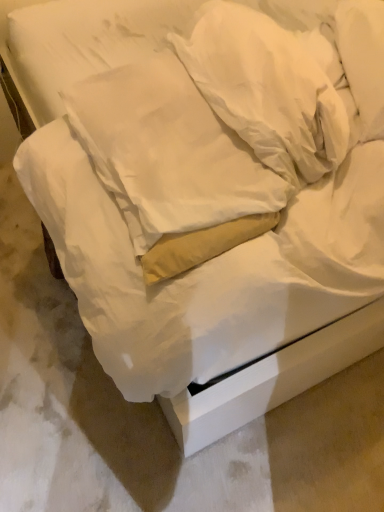
The height and width of the screenshot is (512, 384). What do you see at coordinates (169, 152) in the screenshot?
I see `white soft pillow at center, the second pillow in the right-to-left sequence` at bounding box center [169, 152].

I want to click on white soft pillow at center, the second pillow in the right-to-left sequence, so click(169, 152).

Describe the element at coordinates (270, 87) in the screenshot. I see `white soft pillow at upper center, the first pillow viewed from the right` at that location.

The height and width of the screenshot is (512, 384). I want to click on white soft pillow at upper center, which is the second pillow in left-to-right order, so click(270, 87).

At what (x,y) coordinates should I click in order to perform the action: click on white soft pillow at center, which appears as the 1th pillow when viewed from the left. Please return your answer as a coordinate pair (x, y). Looking at the image, I should click on (169, 152).

Is white soft pillow at center, the second pillow in the right-to-left sequence, at the left side of white soft pillow at upper center, which is the second pillow in left-to-right order?

Indeed, white soft pillow at center, the second pillow in the right-to-left sequence, is positioned on the left side of white soft pillow at upper center, which is the second pillow in left-to-right order.

Considering their positions, is white soft pillow at center, which appears as the 1th pillow when viewed from the left, located in front of or behind white soft pillow at upper center, which is the second pillow in left-to-right order?

Clearly, white soft pillow at center, which appears as the 1th pillow when viewed from the left, is in front of white soft pillow at upper center, which is the second pillow in left-to-right order.

Does point (134, 177) come closer to viewer compared to point (305, 94)?

That is False.

From the image's perspective, is white soft pillow at center, which appears as the 1th pillow when viewed from the left, located above or below white soft pillow at upper center, the first pillow viewed from the right?

Clearly, from the image's perspective, white soft pillow at center, which appears as the 1th pillow when viewed from the left, is below white soft pillow at upper center, the first pillow viewed from the right.

From a real-world perspective, who is located higher, white soft pillow at center, the second pillow in the right-to-left sequence, or white soft pillow at upper center, the first pillow viewed from the right?

In real-world perspective, white soft pillow at upper center, the first pillow viewed from the right, is above.

Does white soft pillow at center, which appears as the 1th pillow when viewed from the left, have a greater width compared to white soft pillow at upper center, the first pillow viewed from the right?

Yes, white soft pillow at center, which appears as the 1th pillow when viewed from the left, is wider than white soft pillow at upper center, the first pillow viewed from the right.

Considering the sizes of objects white soft pillow at center, the second pillow in the right-to-left sequence, and white soft pillow at upper center, the first pillow viewed from the right, in the image provided, who is taller, white soft pillow at center, the second pillow in the right-to-left sequence, or white soft pillow at upper center, the first pillow viewed from the right,?

white soft pillow at upper center, the first pillow viewed from the right, is taller.

Which of these two, white soft pillow at center, the second pillow in the right-to-left sequence, or white soft pillow at upper center, the first pillow viewed from the right, is bigger?

Bigger between the two is white soft pillow at center, the second pillow in the right-to-left sequence.

Which is correct: white soft pillow at center, which appears as the 1th pillow when viewed from the left, is inside white soft pillow at upper center, the first pillow viewed from the right, or outside of it?

white soft pillow at center, which appears as the 1th pillow when viewed from the left, cannot be found inside white soft pillow at upper center, the first pillow viewed from the right.

Is white soft pillow at center, which appears as the 1th pillow when viewed from the left, directly adjacent to white soft pillow at upper center, which is the second pillow in left-to-right order?

No, white soft pillow at center, which appears as the 1th pillow when viewed from the left, is not next to white soft pillow at upper center, which is the second pillow in left-to-right order.

Is white soft pillow at center, the second pillow in the right-to-left sequence, aimed at white soft pillow at upper center, which is the second pillow in left-to-right order?

Yes, white soft pillow at center, the second pillow in the right-to-left sequence, is turned towards white soft pillow at upper center, which is the second pillow in left-to-right order.

How different are the orientations of white soft pillow at center, the second pillow in the right-to-left sequence, and white soft pillow at upper center, which is the second pillow in left-to-right order, in degrees?

They differ by 4.31 degrees in their facing directions.

In order to click on pillow behind the white soft pillow at center, the second pillow in the right-to-left sequence in this screenshot , I will do 270,87.

Does white soft pillow at upper center, the first pillow viewed from the right, appear on the left side of white soft pillow at center, the second pillow in the right-to-left sequence?

No, white soft pillow at upper center, the first pillow viewed from the right, is not to the left of white soft pillow at center, the second pillow in the right-to-left sequence.

Is white soft pillow at upper center, which is the second pillow in left-to-right order, further to the viewer compared to white soft pillow at center, the second pillow in the right-to-left sequence?

Yes, it is behind white soft pillow at center, the second pillow in the right-to-left sequence.

Considering the positions of point (282, 99) and point (67, 111), is point (282, 99) closer or farther from the camera than point (67, 111)?

Point (282, 99).

From the image's perspective, is white soft pillow at upper center, the first pillow viewed from the right, on white soft pillow at center, which appears as the 1th pillow when viewed from the left?

Yes, from the image's perspective, white soft pillow at upper center, the first pillow viewed from the right, is above white soft pillow at center, which appears as the 1th pillow when viewed from the left.

From a real-world perspective, does white soft pillow at upper center, the first pillow viewed from the right, sit lower than white soft pillow at center, the second pillow in the right-to-left sequence?

Actually, white soft pillow at upper center, the first pillow viewed from the right, is physically above white soft pillow at center, the second pillow in the right-to-left sequence, in the real world.

Based on the photo, considering the sizes of white soft pillow at upper center, the first pillow viewed from the right, and white soft pillow at center, which appears as the 1th pillow when viewed from the left, in the image, is white soft pillow at upper center, the first pillow viewed from the right, wider or thinner than white soft pillow at center, which appears as the 1th pillow when viewed from the left,?

white soft pillow at upper center, the first pillow viewed from the right, is thinner than white soft pillow at center, which appears as the 1th pillow when viewed from the left.

Considering the sizes of white soft pillow at upper center, the first pillow viewed from the right, and white soft pillow at center, which appears as the 1th pillow when viewed from the left, in the image, is white soft pillow at upper center, the first pillow viewed from the right, taller or shorter than white soft pillow at center, which appears as the 1th pillow when viewed from the left,?

Considering their sizes, white soft pillow at upper center, the first pillow viewed from the right, has more height than white soft pillow at center, which appears as the 1th pillow when viewed from the left.

Based on their sizes in the image, would you say white soft pillow at upper center, which is the second pillow in left-to-right order, is bigger or smaller than white soft pillow at center, the second pillow in the right-to-left sequence?

In the image, white soft pillow at upper center, which is the second pillow in left-to-right order, appears to be smaller than white soft pillow at center, the second pillow in the right-to-left sequence.

Can we say white soft pillow at upper center, which is the second pillow in left-to-right order, lies outside white soft pillow at center, the second pillow in the right-to-left sequence?

white soft pillow at upper center, which is the second pillow in left-to-right order, lies outside white soft pillow at center, the second pillow in the right-to-left sequence,'s area.

Is white soft pillow at upper center, the first pillow viewed from the right, not close to white soft pillow at center, the second pillow in the right-to-left sequence?

No.

Is white soft pillow at upper center, the first pillow viewed from the right, oriented away from white soft pillow at center, which appears as the 1th pillow when viewed from the left?

Yes, white soft pillow at upper center, the first pillow viewed from the right,'s orientation is away from white soft pillow at center, which appears as the 1th pillow when viewed from the left.

I want to click on pillow on the left of white soft pillow at upper center, the first pillow viewed from the right, so click(169, 152).

Image resolution: width=384 pixels, height=512 pixels. In order to click on pillow on the right of white soft pillow at center, which appears as the 1th pillow when viewed from the left in this screenshot , I will do `click(270, 87)`.

You are a GUI agent. You are given a task and a screenshot of the screen. Output one action in this format:
    pyautogui.click(x=<x>, y=<y>)
    Task: Click on the pillow above the white soft pillow at center, the second pillow in the right-to-left sequence (from a real-world perspective)
    This screenshot has height=512, width=384.
    Given the screenshot: What is the action you would take?
    pyautogui.click(x=270, y=87)